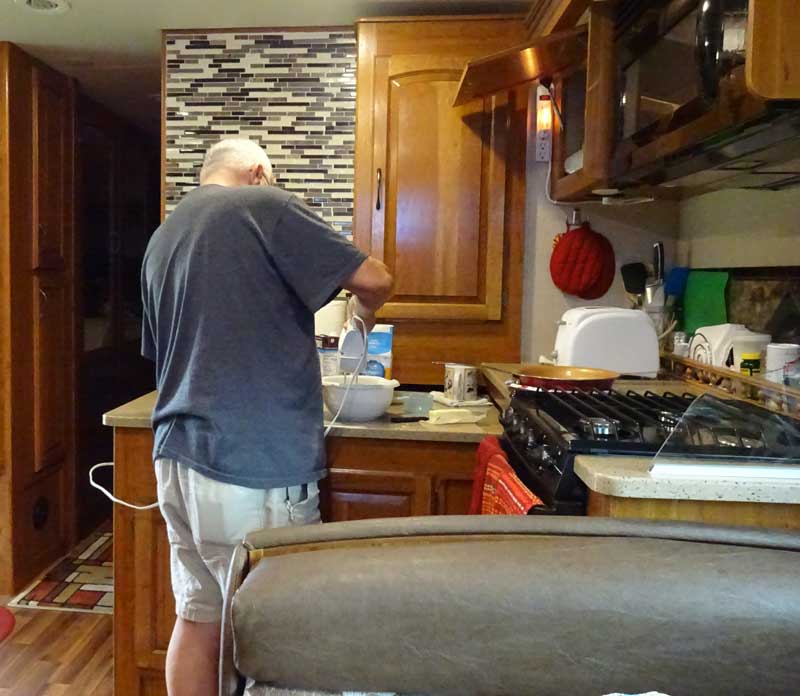
Image resolution: width=800 pixels, height=696 pixels. What are the coordinates of `stovetop` in the screenshot? It's located at (597, 427).